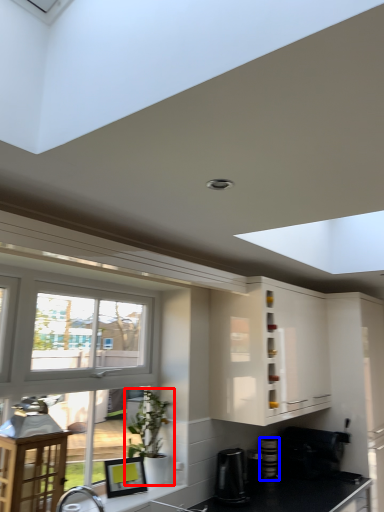
Question: Which of the following is the farthest to the observer, houseplant (highlighted by a red box) or appliance (highlighted by a blue box)?

Choices:
 (A) houseplant
 (B) appliance

Answer: (B)